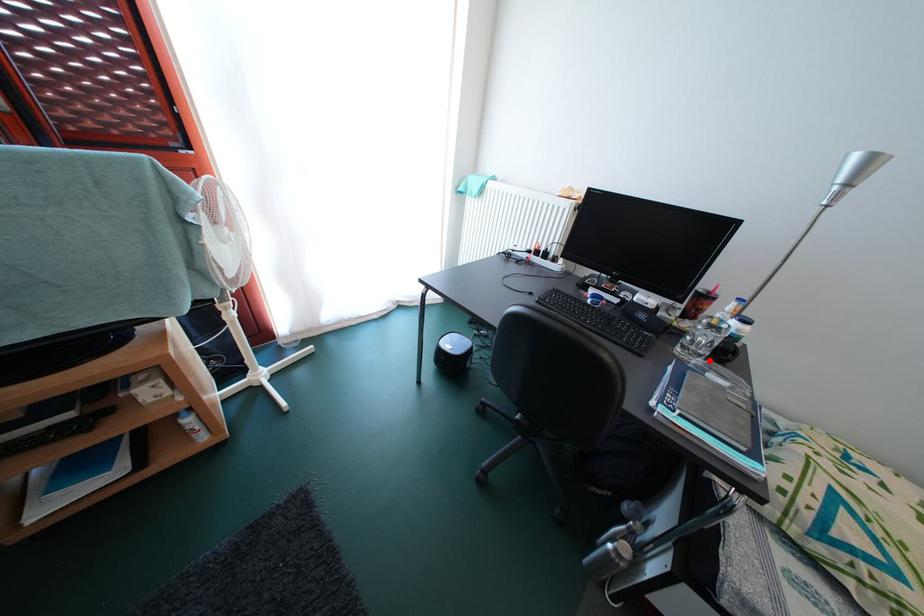
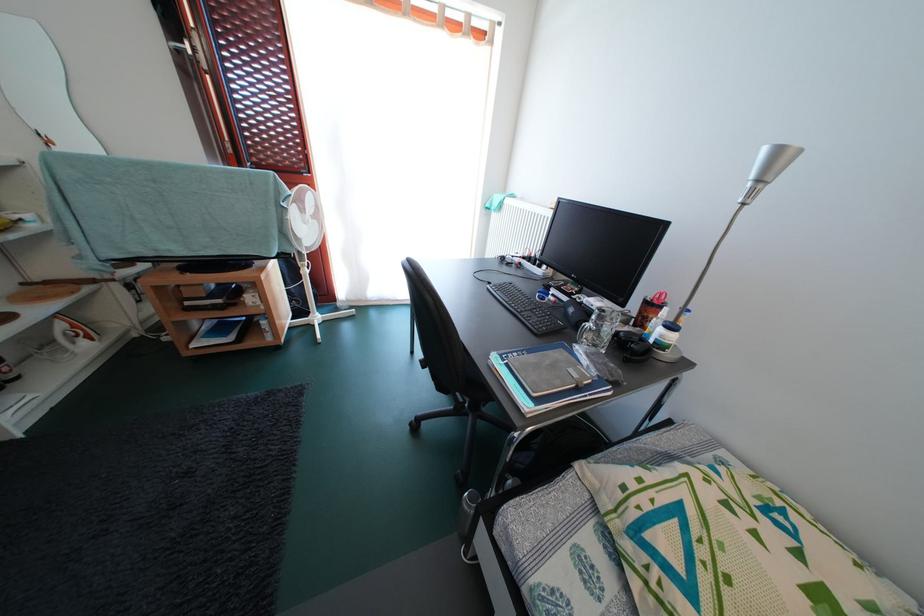
The point at the highlighted location is marked in the first image. Where is the corresponding point in the second image?

(602, 351)